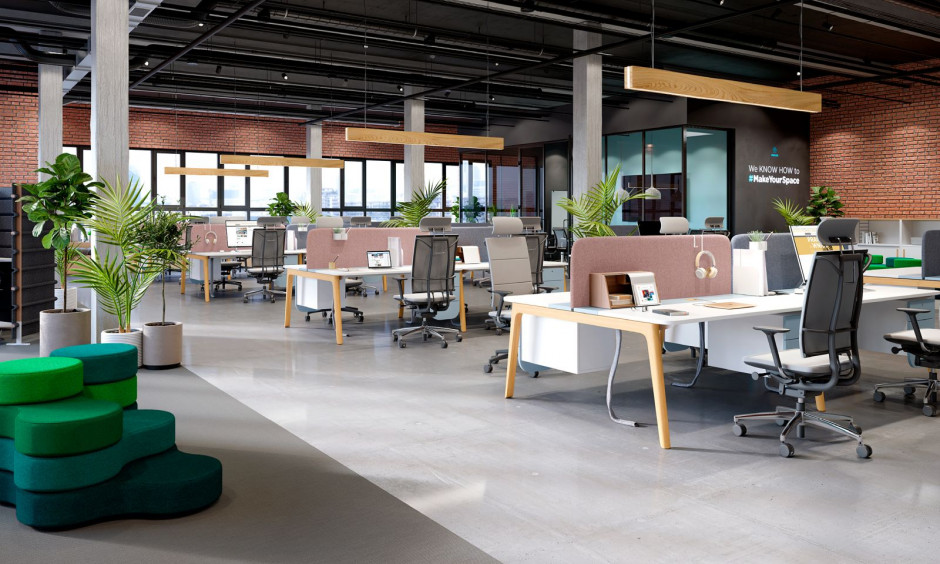
You are a GUI agent. You are given a task and a screenshot of the screen. Output one action in this format:
    pyautogui.click(x=<x>, y=<y>)
    Task: Click on the computers
    
    Given the screenshot: What is the action you would take?
    pyautogui.click(x=785, y=279), pyautogui.click(x=376, y=261), pyautogui.click(x=239, y=236), pyautogui.click(x=466, y=259)